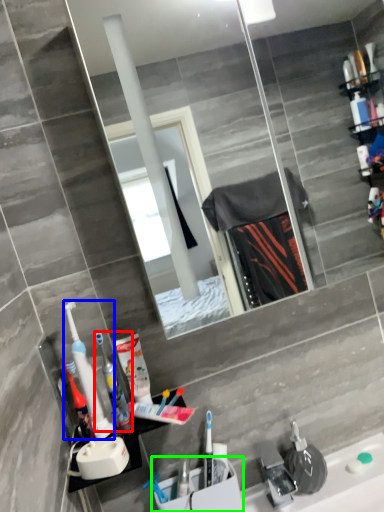
Question: Estimate the real-world distances between objects in this image. Which object is farther from toothbrush (highlighted by a red box), toothbrush (highlighted by a blue box) or sink (highlighted by a green box)?

Choices:
 (A) toothbrush
 (B) sink

Answer: (B)